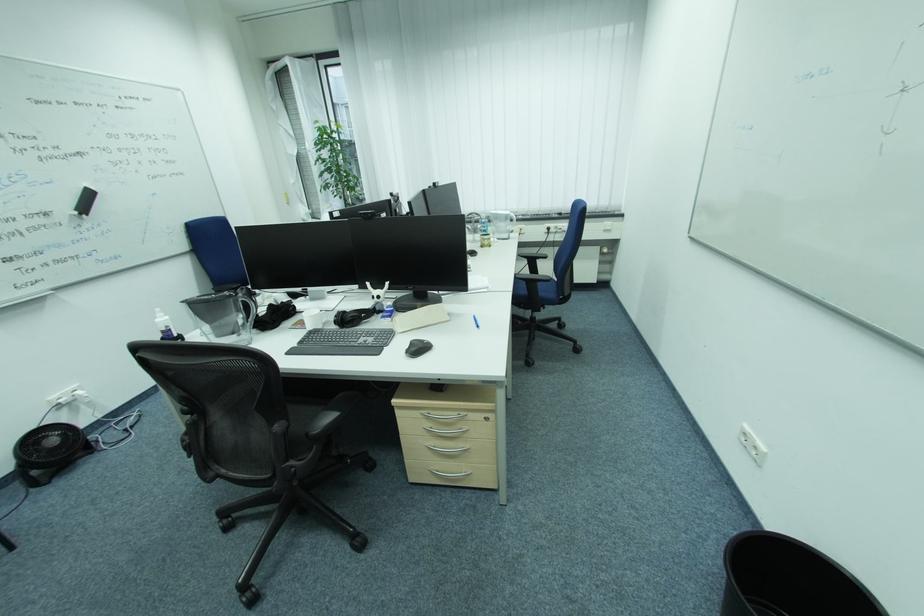
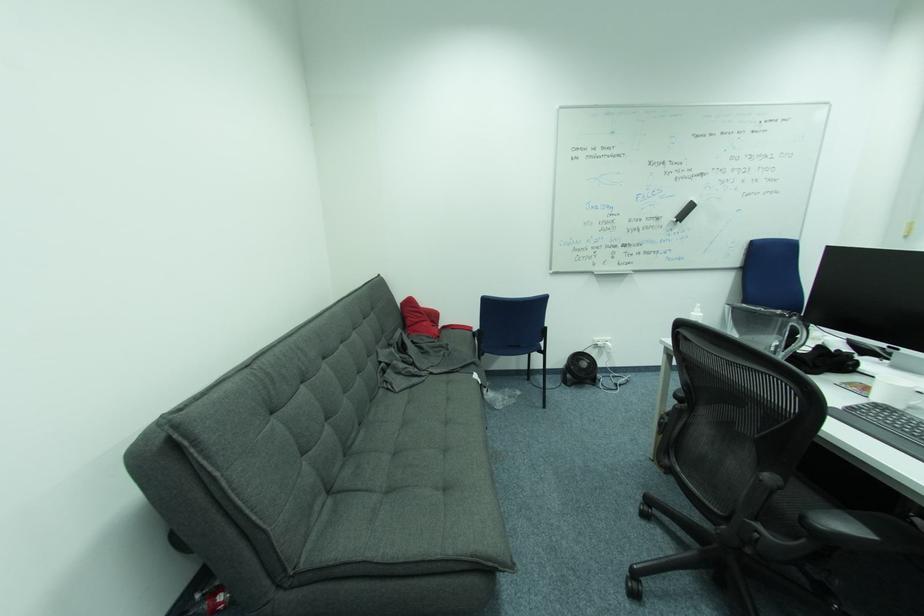
Question: The camera is either moving clockwise (left) or counter-clockwise (right) around the object. The first image is from the beginning of the video and the second image is from the end. Is the camera moving left or right when shooting the video?

Choices:
 (A) Left
 (B) Right

Answer: (B)